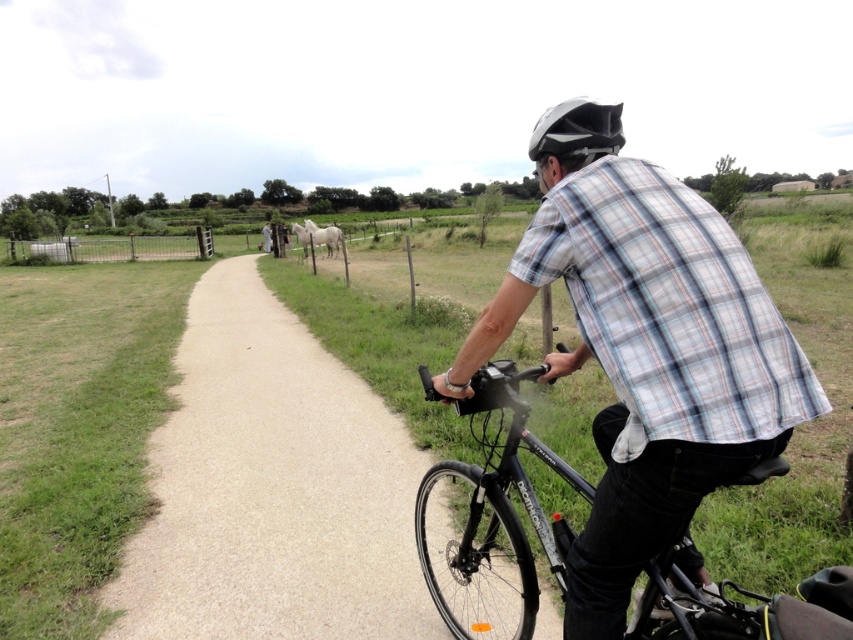
Question: Which of the following is the closest to the observer?

Choices:
 (A) black matte bicycle at center
 (B) paved road at center
 (C) white glossy horse at center

Answer: (A)

Question: Does plaid cotton shirt at center appear on the left side of metallic wire fence at left?

Choices:
 (A) yes
 (B) no

Answer: (B)

Question: Can you confirm if black matte bicycle at center is wider than metallic wire fence at left?

Choices:
 (A) yes
 (B) no

Answer: (B)

Question: Which point is closer to the camera taking this photo?

Choices:
 (A) (302, 241)
 (B) (328, 381)

Answer: (B)

Question: Can you confirm if plaid cotton shirt at center is positioned above white matte bicycle helmet at upper center?

Choices:
 (A) yes
 (B) no

Answer: (B)

Question: Which of the following is the closest to the observer?

Choices:
 (A) (726, 483)
 (B) (544, 161)
 (C) (305, 240)

Answer: (A)